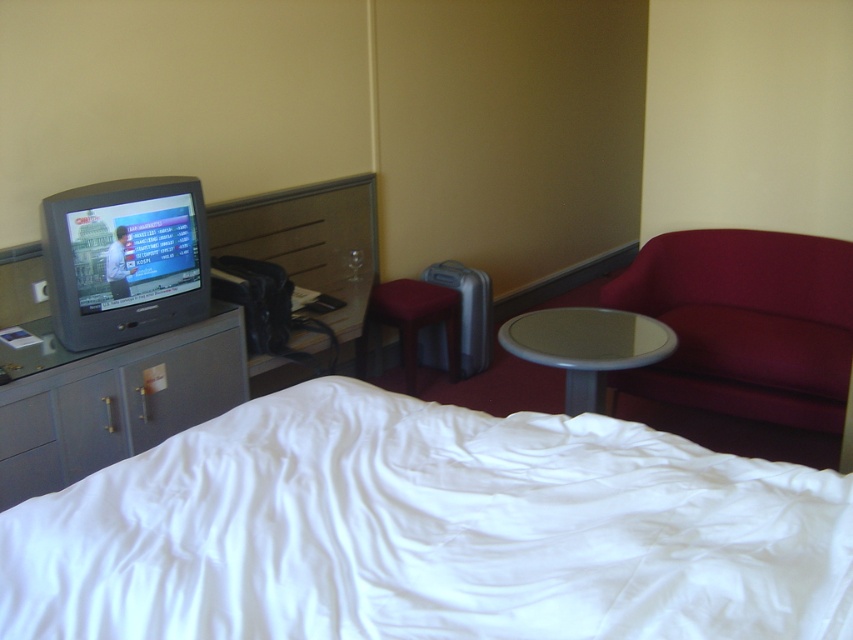
Describe the element at coordinates (111, 400) in the screenshot. I see `gray matte/file cabinet at left` at that location.

Is gray matte/file cabinet at left further to the viewer compared to velvet-like burgundy stool at center?

No, gray matte/file cabinet at left is closer to the viewer.

The height and width of the screenshot is (640, 853). I want to click on gray matte/file cabinet at left, so click(111, 400).

The width and height of the screenshot is (853, 640). What do you see at coordinates (746, 323) in the screenshot? I see `burgundy fabric swivel chair at right` at bounding box center [746, 323].

Is point (740, 252) farther from camera compared to point (410, 282)?

No.

In order to click on burgundy fabric swivel chair at right in this screenshot , I will do `click(746, 323)`.

Can you confirm if burgundy fabric swivel chair at right is bigger than gray matte/file cabinet at left?

Correct, burgundy fabric swivel chair at right is larger in size than gray matte/file cabinet at left.

Is burgundy fabric swivel chair at right closer to camera compared to gray matte/file cabinet at left?

No, burgundy fabric swivel chair at right is behind gray matte/file cabinet at left.

This screenshot has height=640, width=853. Describe the element at coordinates (746, 323) in the screenshot. I see `burgundy fabric swivel chair at right` at that location.

Locate an element on the screen. Image resolution: width=853 pixels, height=640 pixels. burgundy fabric swivel chair at right is located at coordinates (746, 323).